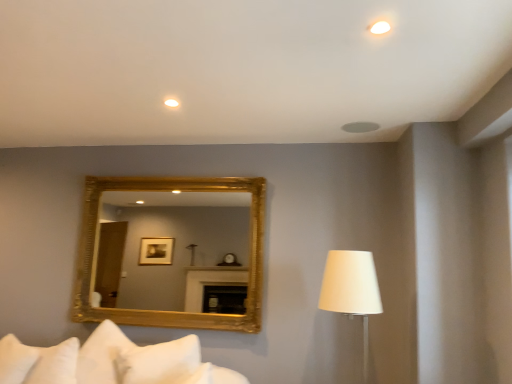
In order to click on vacant area that is situated to the right of white matte ceiling light at upper center, the first lighting from the front in this screenshot , I will do `click(421, 24)`.